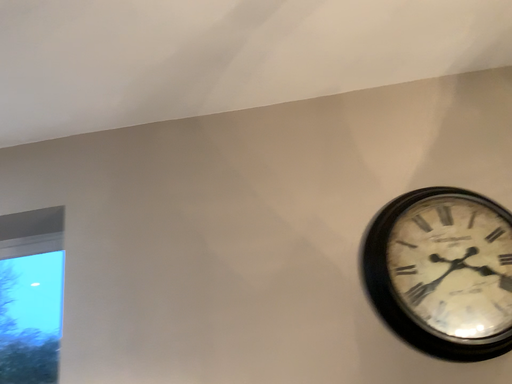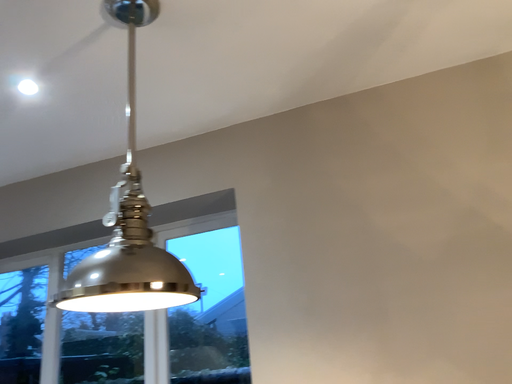
Question: Which way did the camera rotate in the video?

Choices:
 (A) rotated left
 (B) rotated right

Answer: (A)